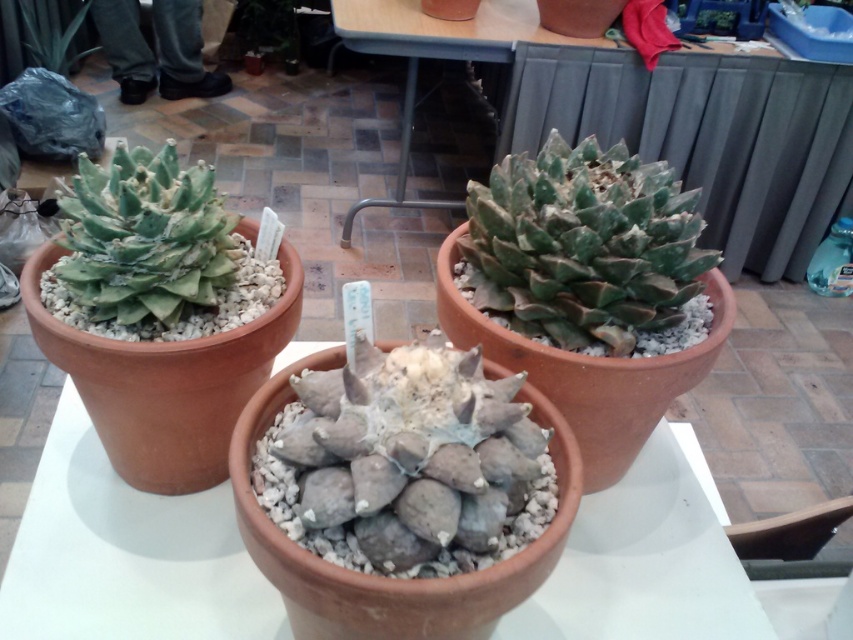
The width and height of the screenshot is (853, 640). What do you see at coordinates (126, 556) in the screenshot? I see `matte clay pot at center` at bounding box center [126, 556].

Is matte clay pot at center thinner than green matte succulent at center?

No, matte clay pot at center is not thinner than green matte succulent at center.

Between point (80, 528) and point (514, 276), which one is positioned behind?

Positioned behind is point (80, 528).

What are the coordinates of `matte clay pot at center` in the screenshot? It's located at (126, 556).

Between green matte succulent at center and green matte succulent at left, which one is positioned higher?

green matte succulent at center is higher up.

Measure the distance between green matte succulent at center and camera.

green matte succulent at center is 37.64 inches from camera.

Which is behind, point (583, 307) or point (189, 278)?

The point (583, 307) is behind.

You are a GUI agent. You are given a task and a screenshot of the screen. Output one action in this format:
    pyautogui.click(x=<x>, y=<y>)
    Task: Click on the green matte succulent at center
    
    Given the screenshot: What is the action you would take?
    pyautogui.click(x=584, y=248)

Is green matte succulent at center above green succulent at upper left?

Incorrect, green matte succulent at center is not positioned above green succulent at upper left.

Which of these two, green matte succulent at center or green succulent at upper left, stands taller?

With more height is green succulent at upper left.

The image size is (853, 640). I want to click on green matte succulent at center, so click(584, 248).

Where is `green matte succulent at center`? This screenshot has width=853, height=640. green matte succulent at center is located at coordinates (584, 248).